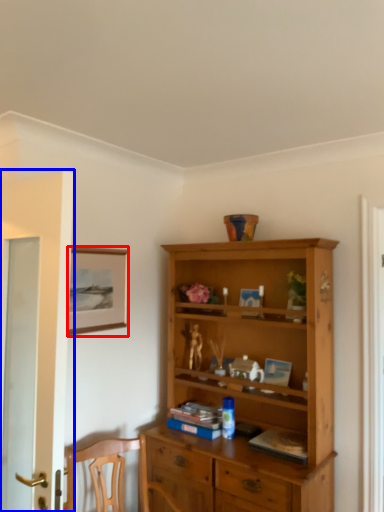
Question: Which object is closer to the camera taking this photo, picture frame (highlighted by a red box) or door (highlighted by a blue box)?

Choices:
 (A) picture frame
 (B) door

Answer: (B)